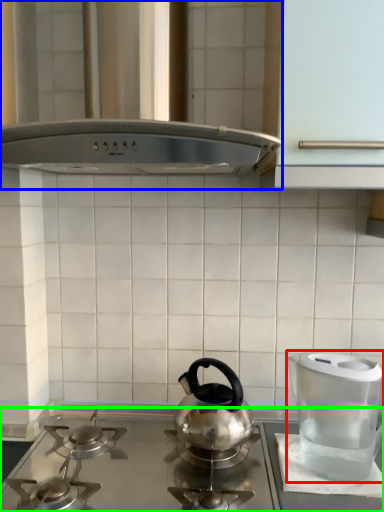
Question: Which object is positioned farthest from kitchen appliance (highlighted by a red box)? Select from vent (highlighted by a blue box) and gas stove (highlighted by a green box).

Choices:
 (A) vent
 (B) gas stove

Answer: (A)